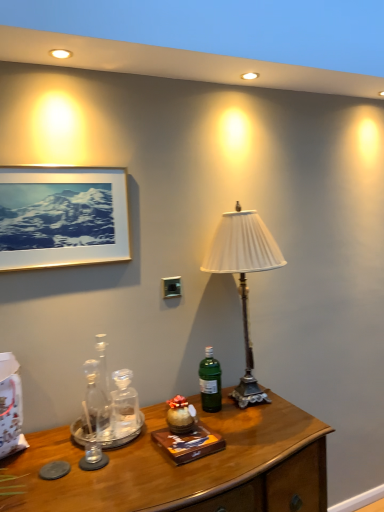
Locate an element on the screen. Image resolution: width=384 pixels, height=512 pixels. gold-framed picture at upper left is located at coordinates (62, 216).

I want to click on white pleated fabric lampshade at center, so click(244, 277).

Find the location of a particular element. The image size is (384, 512). green glass bottle at center is located at coordinates (210, 382).

Image resolution: width=384 pixels, height=512 pixels. What are the coordinates of `bottle directly beneath the gold-framed picture at upper left (from a real-world perspective)` in the screenshot? It's located at (210, 382).

How far apart are gold-framed picture at upper left and green glass bottle at center?

A distance of 81.09 centimeters exists between gold-framed picture at upper left and green glass bottle at center.

From the picture: Is gold-framed picture at upper left far from green glass bottle at center?

No.

From the image's perspective, between gold-framed picture at upper left and green glass bottle at center, who is located below?

From the image's view, green glass bottle at center is below.

Which is in front, white pleated fabric lampshade at center or gold-framed picture at upper left?

gold-framed picture at upper left is more forward.

Is white pleated fabric lampshade at center far from gold-framed picture at upper left?

No.

This screenshot has height=512, width=384. Find the location of `lamp on the right of gold-framed picture at upper left`. lamp on the right of gold-framed picture at upper left is located at coordinates (244, 277).

Considering the relative positions of white pleated fabric lampshade at center and gold-framed picture at upper left in the image provided, is white pleated fabric lampshade at center to the left of gold-framed picture at upper left from the viewer's perspective?

Incorrect, white pleated fabric lampshade at center is not on the left side of gold-framed picture at upper left.

In the image, is gold-framed picture at upper left on the left side or the right side of white pleated fabric lampshade at center?

gold-framed picture at upper left is positioned on white pleated fabric lampshade at center's left side.

Is the depth of gold-framed picture at upper left less than that of white pleated fabric lampshade at center?

Yes.

Does gold-framed picture at upper left have a larger size compared to white pleated fabric lampshade at center?

Actually, gold-framed picture at upper left might be smaller than white pleated fabric lampshade at center.

Is gold-framed picture at upper left wider than white pleated fabric lampshade at center?

In fact, gold-framed picture at upper left might be narrower than white pleated fabric lampshade at center.

This screenshot has width=384, height=512. I want to click on picture frame in front of the green glass bottle at center, so click(x=62, y=216).

Considering the relative sizes of green glass bottle at center and gold-framed picture at upper left in the image provided, is green glass bottle at center shorter than gold-framed picture at upper left?

Yes, green glass bottle at center is shorter than gold-framed picture at upper left.

How many degrees apart are the facing directions of green glass bottle at center and gold-framed picture at upper left?

2.79 degrees.

Does green glass bottle at center have a smaller size compared to gold-framed picture at upper left?

Yes, green glass bottle at center is smaller than gold-framed picture at upper left.

Does point (273, 413) appear closer or farther from the camera than point (211, 379)?

Clearly, point (273, 413) is closer to the camera than point (211, 379).

Measure the distance between wooden desk at lower center and green glass bottle at center.

13.28 inches.

Considering the relative positions of wooden desk at lower center and green glass bottle at center in the image provided, is wooden desk at lower center to the left or to the right of green glass bottle at center?

wooden desk at lower center is to the left of green glass bottle at center.

Where is `lamp that appears behind the wooden desk at lower center`? This screenshot has width=384, height=512. lamp that appears behind the wooden desk at lower center is located at coordinates (244, 277).

Is wooden desk at lower center oriented away from white pleated fabric lampshade at center?

No, wooden desk at lower center is not facing away from white pleated fabric lampshade at center.

Considering the sizes of objects wooden desk at lower center and white pleated fabric lampshade at center in the image provided, who is wider, wooden desk at lower center or white pleated fabric lampshade at center?

wooden desk at lower center is wider.

Considering the relative sizes of wooden desk at lower center and white pleated fabric lampshade at center in the image provided, is wooden desk at lower center smaller than white pleated fabric lampshade at center?

No, wooden desk at lower center is not smaller than white pleated fabric lampshade at center.

Is wooden desk at lower center spatially inside gold-framed picture at upper left, or outside of it?

wooden desk at lower center cannot be found inside gold-framed picture at upper left.

Considering the sizes of objects wooden desk at lower center and gold-framed picture at upper left in the image provided, who is bigger, wooden desk at lower center or gold-framed picture at upper left?

With larger size is wooden desk at lower center.

Between wooden desk at lower center and gold-framed picture at upper left, which one is positioned in front?

wooden desk at lower center is more forward.

I want to click on bottle on the right of gold-framed picture at upper left, so click(x=210, y=382).

Where is `picture frame located on the left of white pleated fabric lampshade at center`? Image resolution: width=384 pixels, height=512 pixels. picture frame located on the left of white pleated fabric lampshade at center is located at coordinates (62, 216).

Looking at the image, which one is located further to gold-framed picture at upper left, green glass bottle at center or white pleated fabric lampshade at center?

Based on the image, green glass bottle at center appears to be further to gold-framed picture at upper left.

Looking at the image, which one is located closer to white pleated fabric lampshade at center, wooden desk at lower center or gold-framed picture at upper left?

gold-framed picture at upper left.

From the image, which object appears to be nearer to wooden desk at lower center, green glass bottle at center or white pleated fabric lampshade at center?

The object closer to wooden desk at lower center is green glass bottle at center.

When comparing their distances from wooden desk at lower center, does green glass bottle at center or gold-framed picture at upper left seem closer?

green glass bottle at center lies closer to wooden desk at lower center than the other object.

Estimate the real-world distances between objects in this image. Which object is further from white pleated fabric lampshade at center, green glass bottle at center or gold-framed picture at upper left?

gold-framed picture at upper left.

Considering their positions, is white pleated fabric lampshade at center positioned further to green glass bottle at center than wooden desk at lower center?

The object further to green glass bottle at center is white pleated fabric lampshade at center.

From the image, which object appears to be nearer to green glass bottle at center, gold-framed picture at upper left or wooden desk at lower center?

wooden desk at lower center.

Based on their spatial positions, is gold-framed picture at upper left or white pleated fabric lampshade at center further from green glass bottle at center?

gold-framed picture at upper left is positioned further to the anchor green glass bottle at center.

Identify the location of bottle between gold-framed picture at upper left and wooden desk at lower center from top to bottom. The width and height of the screenshot is (384, 512). (210, 382).

Locate an element on the screen. bottle situated between gold-framed picture at upper left and white pleated fabric lampshade at center from left to right is located at coordinates (210, 382).

You are a GUI agent. You are given a task and a screenshot of the screen. Output one action in this format:
    pyautogui.click(x=<x>, y=<y>)
    Task: Click on the bottle that lies between white pleated fabric lampshade at center and wooden desk at lower center from top to bottom
    
    Given the screenshot: What is the action you would take?
    pyautogui.click(x=210, y=382)

The width and height of the screenshot is (384, 512). Find the location of `lamp between gold-framed picture at upper left and wooden desk at lower center in the up-down direction`. lamp between gold-framed picture at upper left and wooden desk at lower center in the up-down direction is located at coordinates (244, 277).